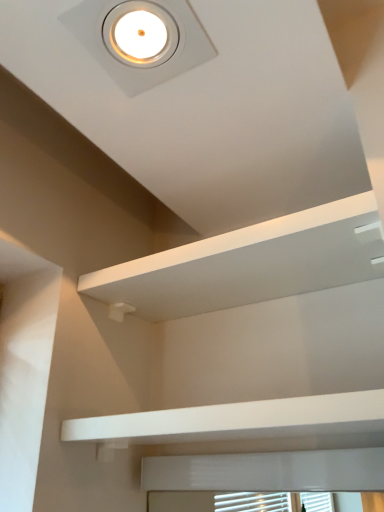
Locate an element on the screen. Image resolution: width=384 pixels, height=512 pixels. free space above white glossy droplight at upper center (from a real-world perspective) is located at coordinates (146, 36).